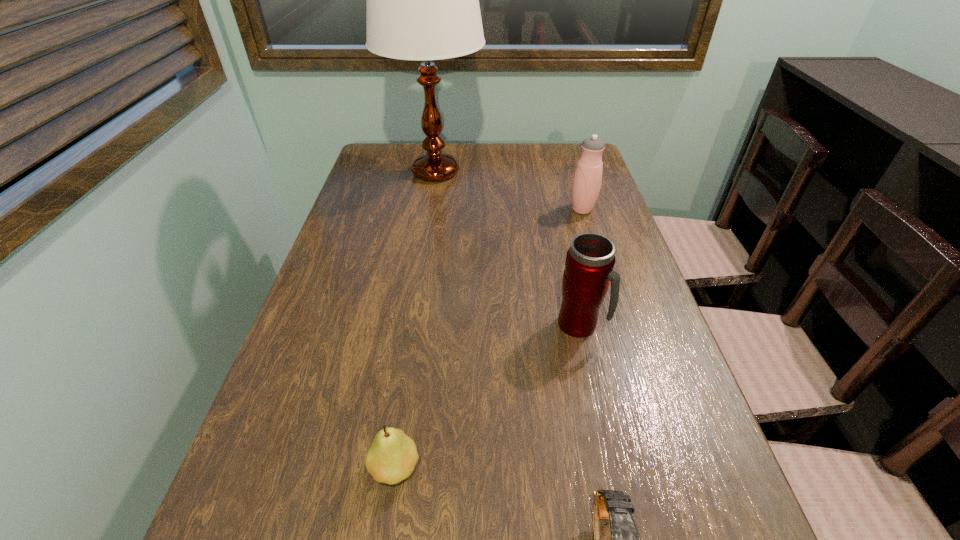
Locate an element on the screen. the tallest object is located at coordinates (422, 0).

I want to click on table lamp, so click(x=422, y=0).

You are a GUI agent. You are given a task and a screenshot of the screen. Output one action in this format:
    pyautogui.click(x=<x>, y=<y>)
    Task: Click on the fourth nearest object
    
    Given the screenshot: What is the action you would take?
    pyautogui.click(x=587, y=179)

The height and width of the screenshot is (540, 960). Find the location of `the nearer thermos bottle`. the nearer thermos bottle is located at coordinates (590, 260).

The image size is (960, 540). What are the coordinates of `pear` in the screenshot? It's located at point(392,457).

Locate an element on the screen. Image resolution: width=960 pixels, height=540 pixels. vacant space located on the front of the tallest object is located at coordinates (429, 212).

Find the location of a particular element. This screenshot has width=960, height=540. vacant region located 0.120m on the front of the farther thermos bottle is located at coordinates (592, 244).

What are the coordinates of `vacant area located 0.070m on the side with the handle of the nearer thermos bottle` in the screenshot? It's located at (637, 325).

Locate an element on the screen. free region located on the right of the second nearest object is located at coordinates (579, 468).

Identify the location of object present at the far edge. (422, 0).